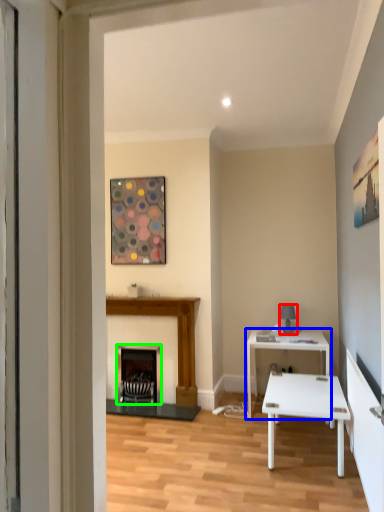
Question: Which object is positioned farthest from lamp (highlighted by a red box)? Select from table (highlighted by a blue box) and fireplace (highlighted by a green box).

Choices:
 (A) table
 (B) fireplace

Answer: (B)